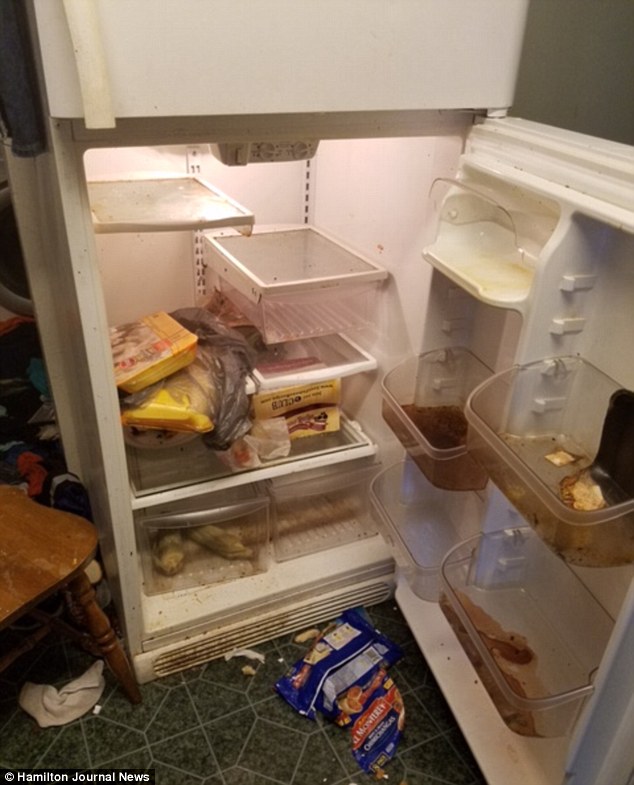
The height and width of the screenshot is (785, 634). What are the coordinates of `floor` in the screenshot? It's located at (231, 736).